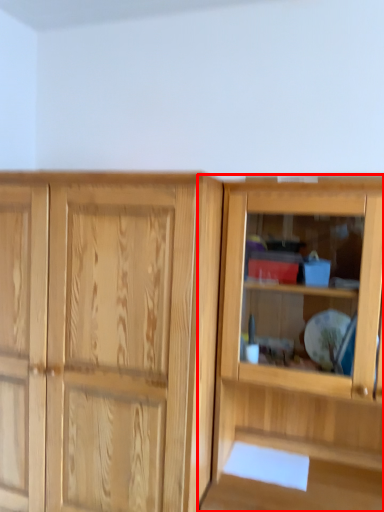
Question: From the image's perspective, what is the correct spatial positioning of cupboard (annotated by the red box) in reference to screen door?

Choices:
 (A) below
 (B) above

Answer: (B)